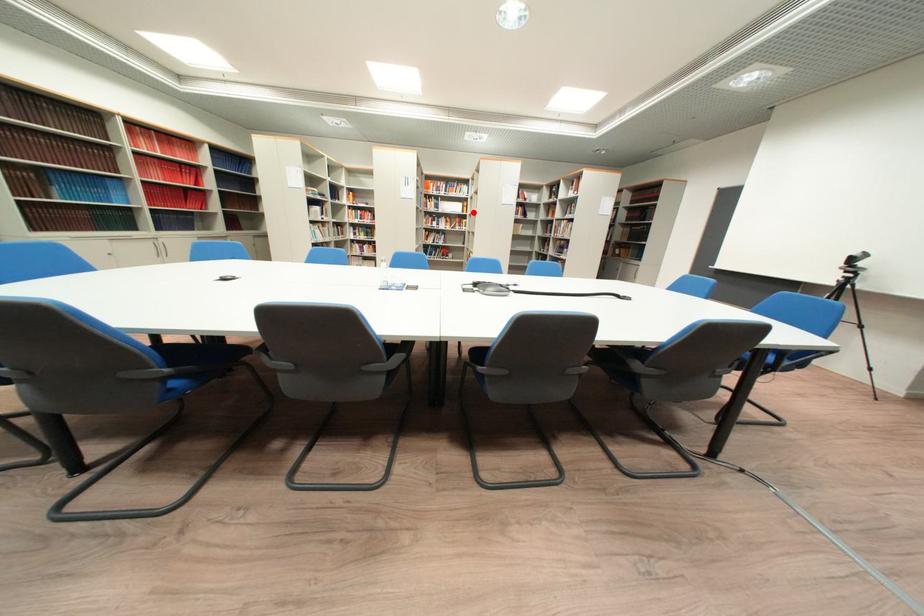
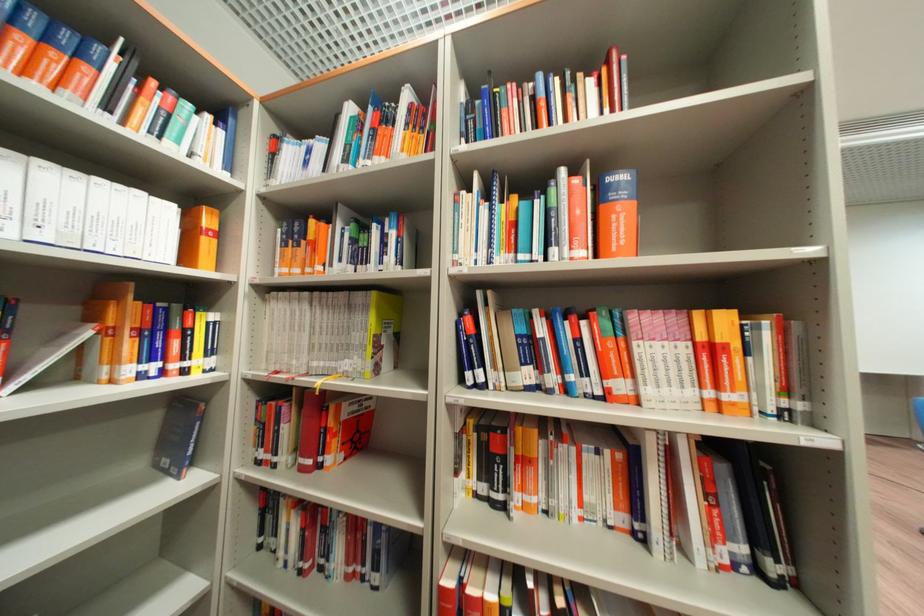
Question: I am providing you with two images of the same scene from different viewpoints. A red point is marked on the first image. Can you still see the location of the red point in image 2?

Choices:
 (A) Yes
 (B) No

Answer: (A)